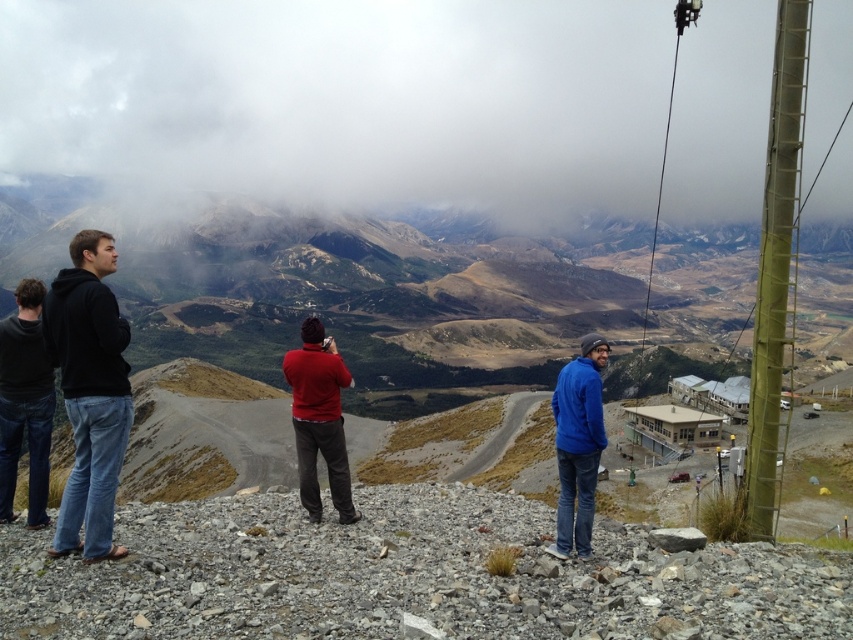
You are planning to take a photo of the brown grassy mountain at center and the matte red sweater at center. Which object should you focus on first if you want to capture both in the same frame without moving the camera?

The brown grassy mountain at center is wider than the matte red sweater at center, so you should focus on the wider object first to ensure it fits within the frame.

You are standing at the origin point in the image. Which direction should you move to reach the black cotton hoodie at left?

The black cotton hoodie at left is located at coordinates 0.614 on the x axis and 0.106 on the y axis. To reach it from the origin, move right along the x axis to 0.614 and down along the y axis to 0.106.